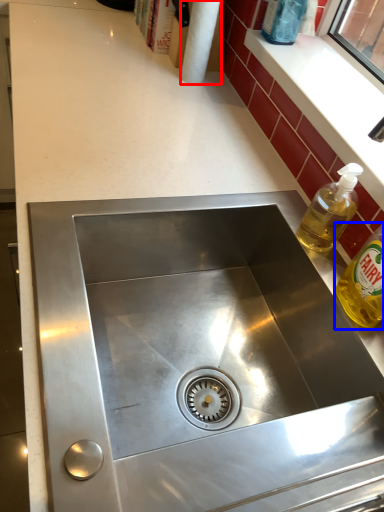
Question: Which object appears farthest to the camera in this image, paper towel (highlighted by a red box) or bottle (highlighted by a blue box)?

Choices:
 (A) paper towel
 (B) bottle

Answer: (A)